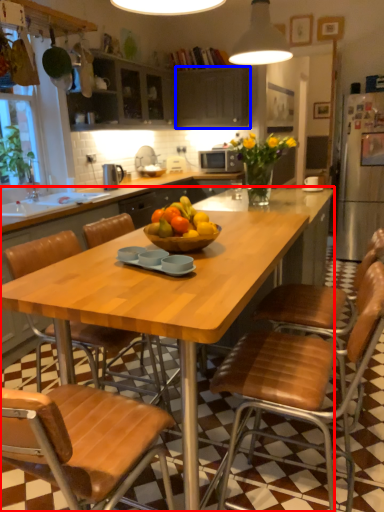
Question: Among these objects, which one is farthest to the camera, desk (highlighted by a red box) or cabinetry (highlighted by a blue box)?

Choices:
 (A) desk
 (B) cabinetry

Answer: (B)